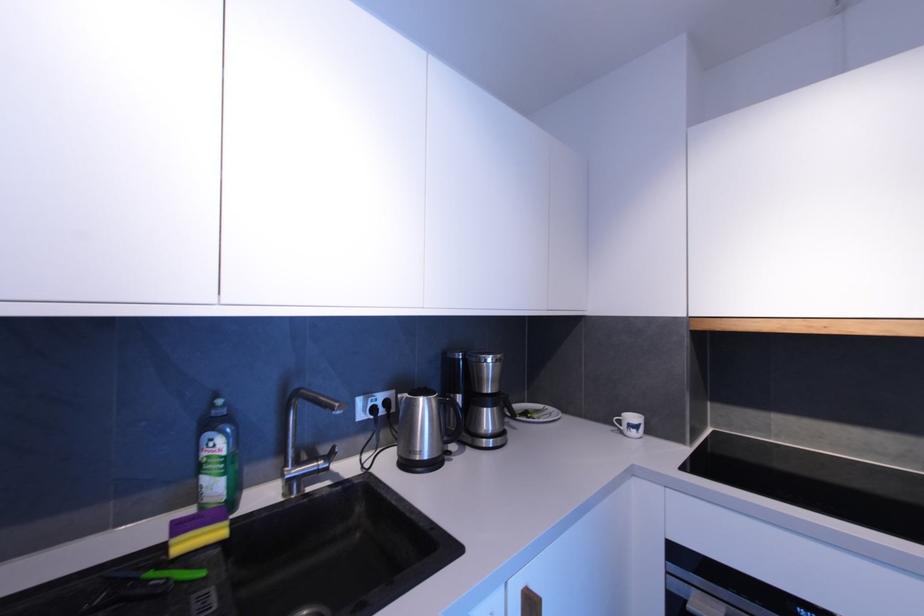
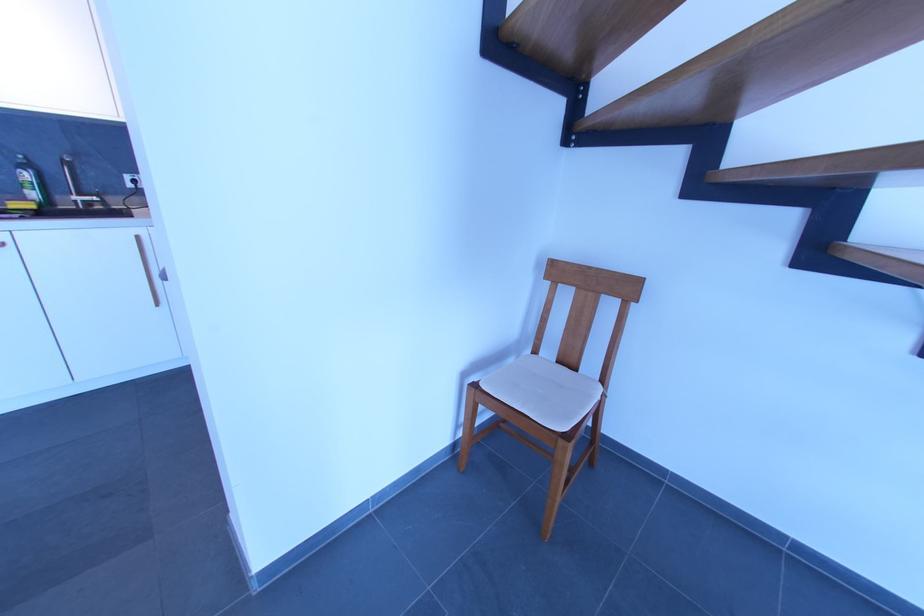
Question: I am providing you with two images of the same scene from different viewpoints. Please identify which objects are invisible in image2.

Choices:
 (A) small white plate
 (B) faucet handle
 (C) yellow sponge
 (D) brown sofa surface

Answer: (A)